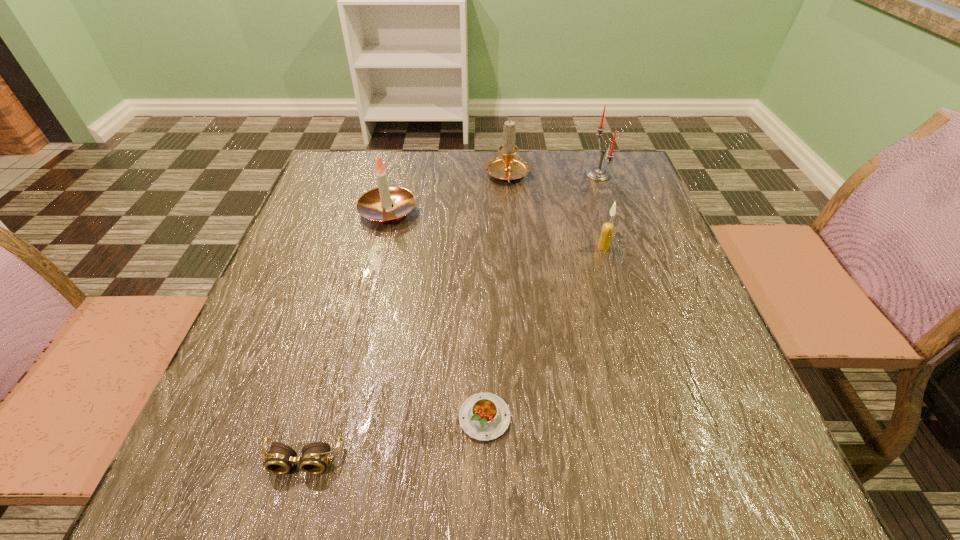
Where is `free space located 0.240m on the front-facing side of the rightmost object`? free space located 0.240m on the front-facing side of the rightmost object is located at coordinates (497, 175).

Identify the location of vacant space located on the front-facing side of the rightmost object. (531, 175).

Where is `vacant area situated on the front-facing side of the rightmost object`? The image size is (960, 540). vacant area situated on the front-facing side of the rightmost object is located at coordinates tap(491, 175).

I want to click on free space located on the front of the third candle from right to left, so click(513, 237).

Find the location of `free space located on the right of the fourth nearest object`. free space located on the right of the fourth nearest object is located at coordinates tap(515, 212).

This screenshot has width=960, height=540. In order to click on vacant space positioned on the back of the fourth farthest object in this screenshot , I will do `click(580, 170)`.

You are a GUI agent. You are given a task and a screenshot of the screen. Output one action in this format:
    pyautogui.click(x=<x>, y=<y>)
    Task: Click on the free space located 0.370m on the right of the pudding
    The width and height of the screenshot is (960, 540).
    Given the screenshot: What is the action you would take?
    tap(744, 417)

The width and height of the screenshot is (960, 540). Identify the location of goggles present at the near edge. (279, 460).

Where is `pudding at the near edge`? The image size is (960, 540). pudding at the near edge is located at coordinates (484, 416).

Locate an element on the screen. This screenshot has width=960, height=540. candle that is at the left edge is located at coordinates (376, 204).